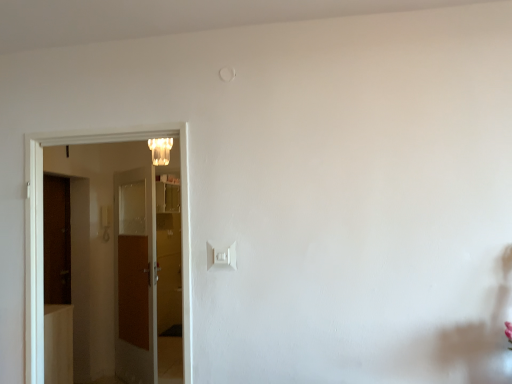
Question: Is translucent glass chandelier at upper center in front of or behind white plastic light switch at center in the image?

Choices:
 (A) behind
 (B) front

Answer: (A)

Question: Considering the positions of translucent glass chandelier at upper center and white plastic light switch at center in the image, is translucent glass chandelier at upper center wider or thinner than white plastic light switch at center?

Choices:
 (A) wide
 (B) thin

Answer: (A)

Question: Which object is the farthest from the brown wooden door at left, which is counted as the 2th door, starting from the front?

Choices:
 (A) white wooden door at left, which appears as the second door when viewed from the back
 (B) translucent glass chandelier at upper center
 (C) white plastic light switch at center

Answer: (C)

Question: Considering the real-world distances, which object is farthest from the translucent glass chandelier at upper center?

Choices:
 (A) brown wooden door at left, the 1th door from the back
 (B) white plastic light switch at center
 (C) white wooden door at left, which appears as the second door when viewed from the back

Answer: (B)